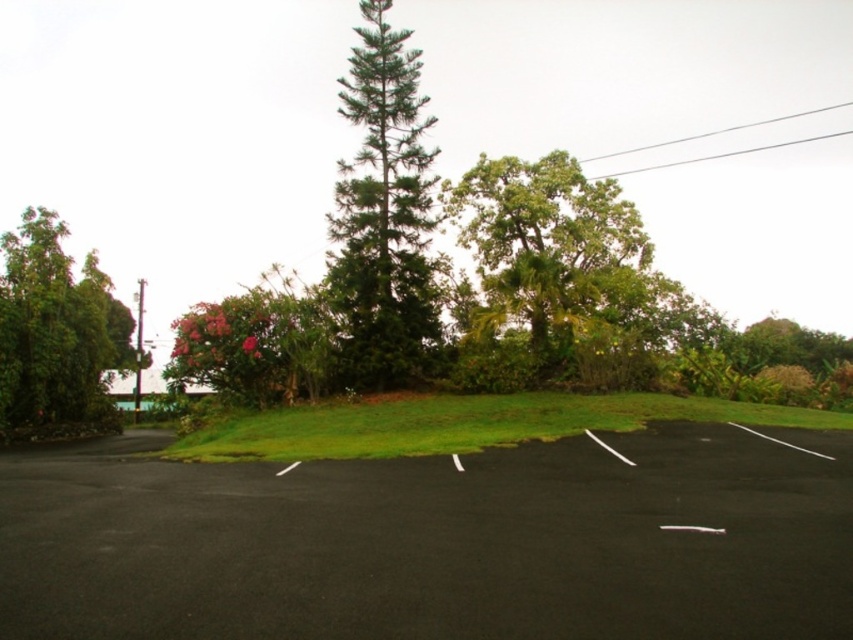
Question: Is green leafy tree at center positioned in front of green grassy hillside at center?

Choices:
 (A) yes
 (B) no

Answer: (B)

Question: Which object appears closest to the camera in this image?

Choices:
 (A) green leafy tree at left
 (B) black asphalt parking lot at center
 (C) pink leafy tree at center-left
 (D) green leafy tree at center

Answer: (B)

Question: Is black asphalt parking lot at center above green leafy tree at left?

Choices:
 (A) no
 (B) yes

Answer: (A)

Question: Which object appears farthest from the camera in this image?

Choices:
 (A) green leafy tree at center
 (B) black asphalt parking lot at center

Answer: (A)

Question: Does green leafy tree at center have a smaller size compared to green grassy hillside at center?

Choices:
 (A) yes
 (B) no

Answer: (B)

Question: Which object appears closest to the camera in this image?

Choices:
 (A) green leafy tree at center
 (B) green grassy hillside at center

Answer: (B)